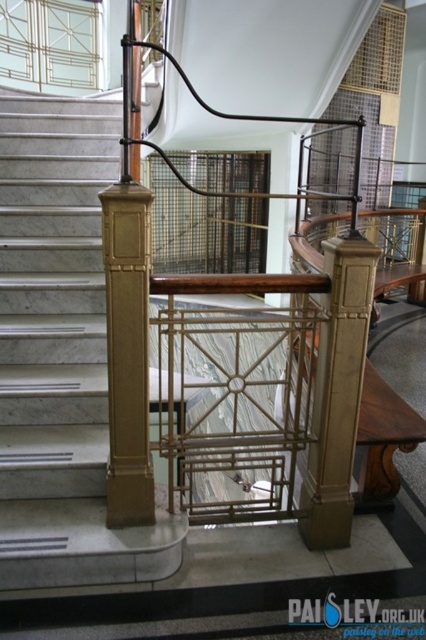
Does matte gold stair at left appear over gold polished wood pillar at center?

Indeed, matte gold stair at left is positioned over gold polished wood pillar at center.

Measure the distance between point (48, 490) and camera.

Point (48, 490) and camera are 7.49 feet apart.

Is point (16, 506) behind point (327, 532)?

That is True.

Locate an element on the screen. The image size is (426, 640). matte gold stair at left is located at coordinates (60, 355).